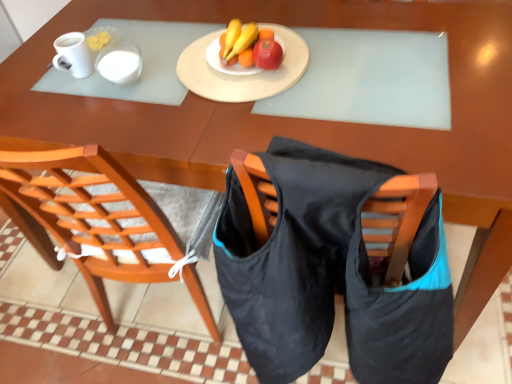
Where is `vacant area that lies to the right of white glossy mug at upper left`? The width and height of the screenshot is (512, 384). vacant area that lies to the right of white glossy mug at upper left is located at coordinates (153, 57).